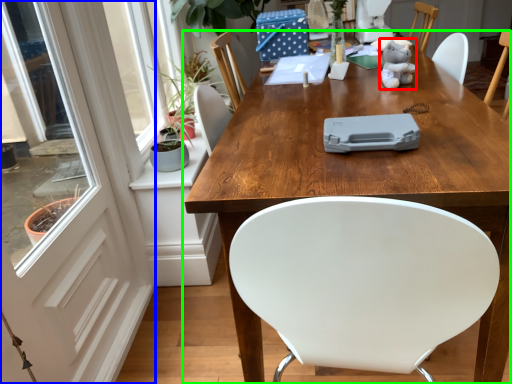
Question: Which object is positioned farthest from toy (highlighted by a red box)? Select from screen door (highlighted by a blue box) and table (highlighted by a green box).

Choices:
 (A) screen door
 (B) table

Answer: (A)